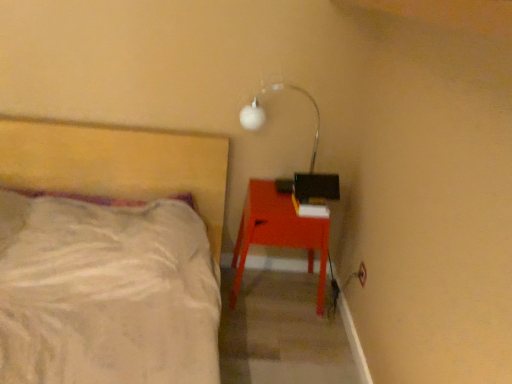
Describe the element at coordinates (310, 162) in the screenshot. I see `white glossy lamp at upper right` at that location.

In order to face white glossy lamp at upper right, should I rotate leftwards or rightwards?

A 3.739 degree turn to the right will do.

This screenshot has height=384, width=512. Identify the location of white glossy lamp at upper right. (310, 162).

What is the approximate width of white glossy lamp at upper right?

The width of white glossy lamp at upper right is 5.91 inches.

Measure the distance between white glossy lamp at upper right and camera.

white glossy lamp at upper right and camera are 6.03 feet apart from each other.

In order to face matte red desk at right, should I rotate leftwards or rightwards?

Turn right approximately 3.325 degrees to face it.

Identify the location of matte red desk at right. (279, 232).

This screenshot has height=384, width=512. Describe the element at coordinates (279, 232) in the screenshot. I see `matte red desk at right` at that location.

Find the location of `white glossy lamp at upper right`. white glossy lamp at upper right is located at coordinates (310, 162).

Does white glossy lamp at upper right appear on the right side of matte red desk at right?

Yes, white glossy lamp at upper right is to the right of matte red desk at right.

Who is more distant, white glossy lamp at upper right or matte red desk at right?

Positioned behind is matte red desk at right.

Is point (258, 124) behind point (253, 226)?

Yes, it is behind point (253, 226).

From the image's perspective, which object appears higher, white glossy lamp at upper right or matte red desk at right?

white glossy lamp at upper right.

From a real-world perspective, who is located lower, white glossy lamp at upper right or matte red desk at right?

From a 3D spatial view, matte red desk at right is below.

Is white glossy lamp at upper right wider than matte red desk at right?

No, white glossy lamp at upper right is not wider than matte red desk at right.

Considering the relative sizes of white glossy lamp at upper right and matte red desk at right in the image provided, is white glossy lamp at upper right shorter than matte red desk at right?

Yes, white glossy lamp at upper right is shorter than matte red desk at right.

Does white glossy lamp at upper right have a smaller size compared to matte red desk at right?

Yes.

Choose the correct answer: Is white glossy lamp at upper right inside matte red desk at right or outside it?

white glossy lamp at upper right exists outside the volume of matte red desk at right.

Would you consider white glossy lamp at upper right to be distant from matte red desk at right?

No, there isn't a large distance between white glossy lamp at upper right and matte red desk at right.

Is white glossy lamp at upper right oriented towards matte red desk at right?

No, white glossy lamp at upper right is not aimed at matte red desk at right.

In the image, there is a matte red desk at right. Find the location of `lamp above it (from the image's perspective)`. lamp above it (from the image's perspective) is located at coordinates (310, 162).

Is matte red desk at right to the left or to the right of white glossy lamp at upper right in the image?

matte red desk at right is positioned on white glossy lamp at upper right's left side.

Consider the image. Considering the relative positions of matte red desk at right and white glossy lamp at upper right in the image provided, is matte red desk at right behind white glossy lamp at upper right?

Yes, matte red desk at right is further from the camera.

Is point (267, 224) farther from viewer compared to point (335, 198)?

No, (267, 224) is closer to viewer.

In the scene shown: From the image's perspective, which one is positioned lower, matte red desk at right or white glossy lamp at upper right?

matte red desk at right.

From a real-world perspective, is matte red desk at right over white glossy lamp at upper right?

Incorrect, from a real-world perspective, matte red desk at right is lower than white glossy lamp at upper right.

Considering the sizes of objects matte red desk at right and white glossy lamp at upper right in the image provided, who is wider, matte red desk at right or white glossy lamp at upper right?

matte red desk at right is wider.

Between matte red desk at right and white glossy lamp at upper right, which one has less height?

white glossy lamp at upper right.

Can you confirm if matte red desk at right is smaller than white glossy lamp at upper right?

No, matte red desk at right is not smaller than white glossy lamp at upper right.

Is matte red desk at right located outside white glossy lamp at upper right?

matte red desk at right is positioned outside white glossy lamp at upper right.

Is matte red desk at right positioned far away from white glossy lamp at upper right?

matte red desk at right is near white glossy lamp at upper right, not far away.

Is white glossy lamp at upper right at the back of matte red desk at right?

No, matte red desk at right's orientation is not away from white glossy lamp at upper right.

Can you tell me how much matte red desk at right and white glossy lamp at upper right differ in facing direction?

There is a 0.414-degree angle between the facing directions of matte red desk at right and white glossy lamp at upper right.

From the picture: How distant is matte red desk at right from white glossy lamp at upper right?

matte red desk at right is 8.89 inches away from white glossy lamp at upper right.

Find the location of a particular element. Image resolution: width=512 pixels, height=384 pixels. desk lying below the white glossy lamp at upper right (from the image's perspective) is located at coordinates (279, 232).

Where is `lamp above the matte red desk at right (from the image's perspective)`? This screenshot has width=512, height=384. lamp above the matte red desk at right (from the image's perspective) is located at coordinates (310, 162).

Identify the location of lamp above the matte red desk at right (from a real-world perspective). (310, 162).